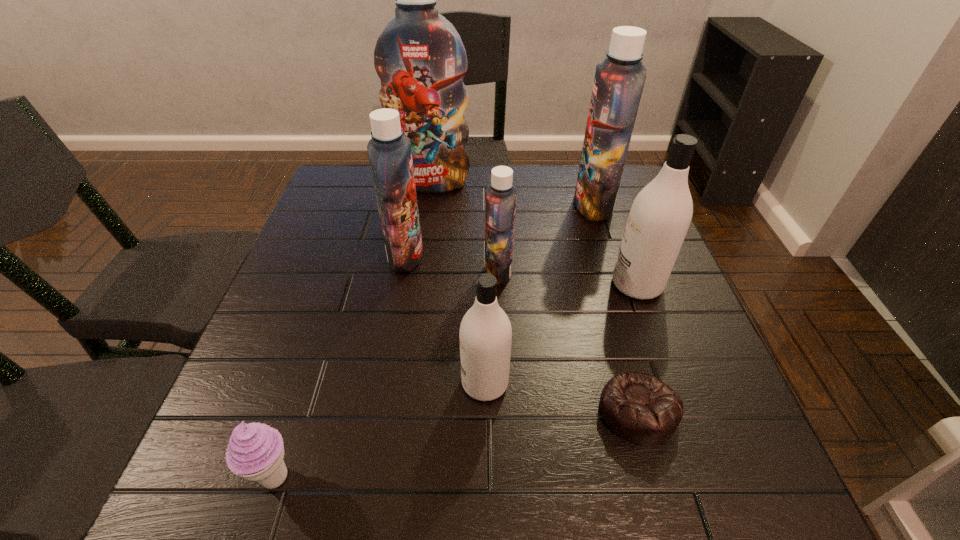
You are a GUI agent. You are given a task and a screenshot of the screen. Output one action in this format:
    pyautogui.click(x=<x>, y=<y>)
    Task: Click on the seventh tallest object
    The width and height of the screenshot is (960, 540).
    Given the screenshot: What is the action you would take?
    pyautogui.click(x=255, y=452)

The image size is (960, 540). In order to click on icecream in this screenshot , I will do `click(255, 452)`.

Locate an element on the screen. This screenshot has height=540, width=960. the shortest object is located at coordinates (640, 408).

You are a GUI agent. You are given a task and a screenshot of the screen. Output one action in this format:
    pyautogui.click(x=<x>, y=<y>)
    Task: Click on the brown beanbag
    This screenshot has height=540, width=960.
    Given the screenshot: What is the action you would take?
    pyautogui.click(x=640, y=408)

The image size is (960, 540). In order to click on free space located on the front label of the biggest blue shampoo in this screenshot , I will do `click(424, 231)`.

At what (x,y) coordinates should I click in order to perform the action: click on vacant area located 0.100m on the front label of the rightmost blue shampoo. Please return your answer as a coordinate pair (x, y). The width and height of the screenshot is (960, 540). Looking at the image, I should click on (539, 205).

Identify the location of vacant space located on the front label of the rightmost blue shampoo. Image resolution: width=960 pixels, height=540 pixels. (510, 205).

You are a GUI agent. You are given a task and a screenshot of the screen. Output one action in this format:
    pyautogui.click(x=<x>, y=<y>)
    Task: Click on the free region located on the front label of the rightmost blue shampoo
    This screenshot has width=960, height=540.
    Given the screenshot: What is the action you would take?
    pyautogui.click(x=507, y=205)

Image resolution: width=960 pixels, height=540 pixels. I want to click on free space located on the front label of the third biggest blue shampoo, so click(x=516, y=255).

Image resolution: width=960 pixels, height=540 pixels. What are the coordinates of `free space located on the front-facing side of the right white shampoo` in the screenshot? It's located at (586, 285).